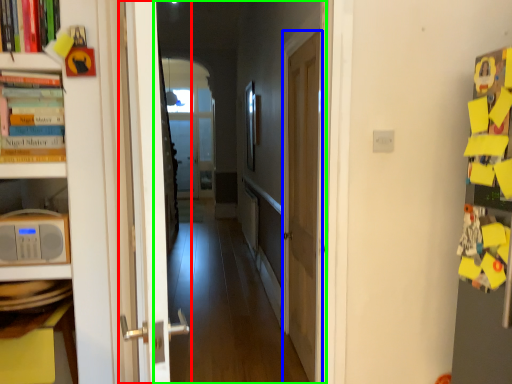
Question: Which object is positioned farthest from door (highlighted by a red box)? Select from door (highlighted by a blue box) and corridor (highlighted by a green box).

Choices:
 (A) door
 (B) corridor

Answer: (B)